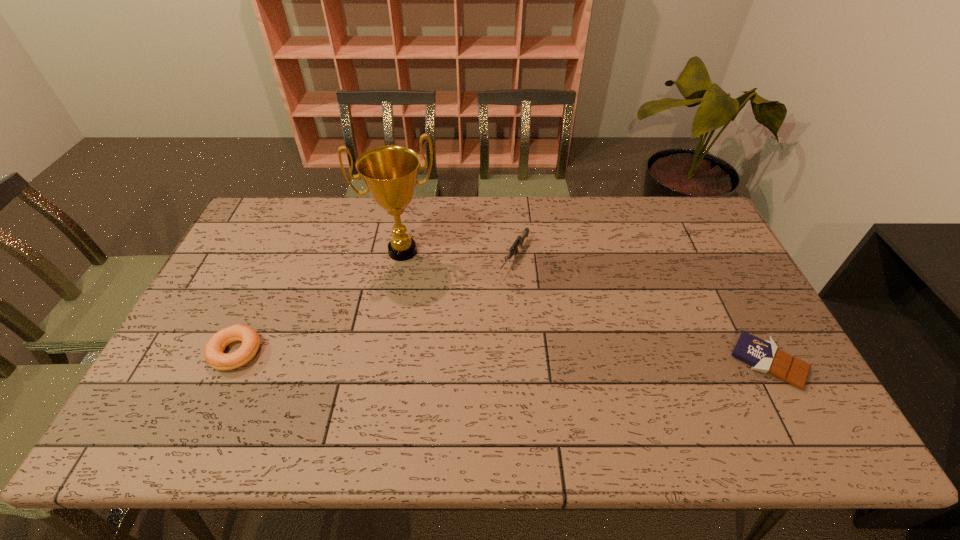
You are a GUI agent. You are given a task and a screenshot of the screen. Output one action in this format:
    pyautogui.click(x=<x>, y=<y>)
    Task: Click on the object located in the left edge section of the desktop
    This screenshot has height=540, width=960.
    Given the screenshot: What is the action you would take?
    pyautogui.click(x=214, y=348)

This screenshot has height=540, width=960. Identify the location of object that is at the right edge. (762, 355).

Where is `object that is at the near left corner`? object that is at the near left corner is located at coordinates (214, 348).

Image resolution: width=960 pixels, height=540 pixels. What are the coordinates of `object positioned at the near right corner` in the screenshot? It's located at (762, 355).

In the image, there is a desktop. Where is `vacant space at the far edge`? The height and width of the screenshot is (540, 960). vacant space at the far edge is located at coordinates (649, 225).

This screenshot has width=960, height=540. Identify the location of vacant space at the left edge of the desktop. (241, 269).

Where is `free region at the right edge`? The width and height of the screenshot is (960, 540). free region at the right edge is located at coordinates pos(710,323).

Find the location of a particular element. vacant region at the far left corner of the desktop is located at coordinates (252, 219).

You are a GUI agent. You are given a task and a screenshot of the screen. Output one action in this format:
    pyautogui.click(x=<x>, y=<y>)
    Task: Click on the free space at the far right corner of the desktop
    Image resolution: width=960 pixels, height=540 pixels.
    Given the screenshot: What is the action you would take?
    pyautogui.click(x=701, y=237)

Identify the location of empty space that is in between the tallest object and the chocolate bar. (586, 307).